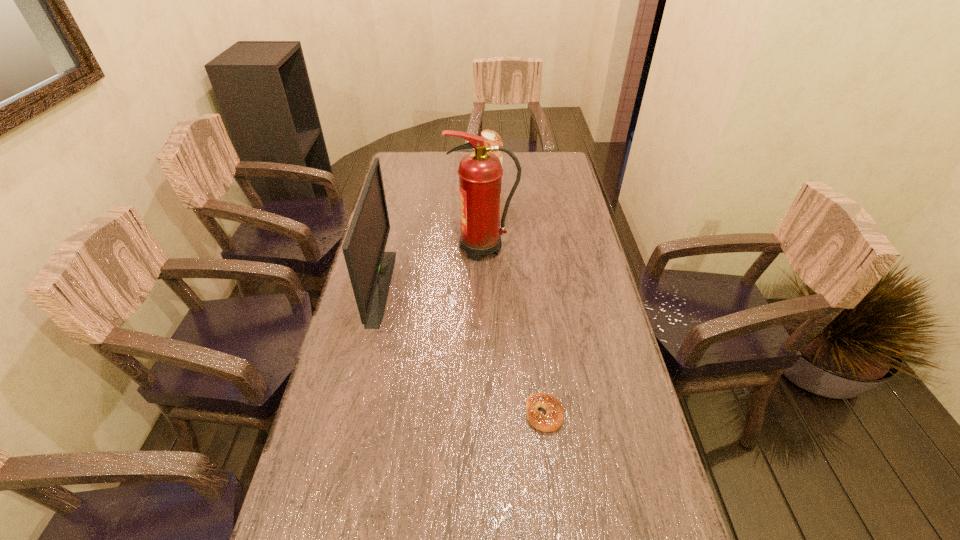
Locate an element on the screen. This screenshot has width=960, height=540. fire extinguisher is located at coordinates (480, 172).

Identify the location of the second tallest object. The height and width of the screenshot is (540, 960). (370, 269).

Find the location of a particular element. monitor is located at coordinates (370, 269).

I want to click on burrito, so click(491, 138).

Locate an element on the screen. The width and height of the screenshot is (960, 540). the farthest object is located at coordinates [x=491, y=138].

The height and width of the screenshot is (540, 960). What are the coordinates of `the shortest object` in the screenshot? It's located at (553, 419).

Identify the location of the nearest object. This screenshot has height=540, width=960. (553, 419).

Find the location of a particular element. vacant space located 0.170m on the front-facing side of the tallest object is located at coordinates (399, 248).

The image size is (960, 540). I want to click on vacant space located on the front-facing side of the tallest object, so click(431, 248).

Identify the location of free space located 0.190m on the front-facing side of the tallest object. The height and width of the screenshot is (540, 960). (394, 248).